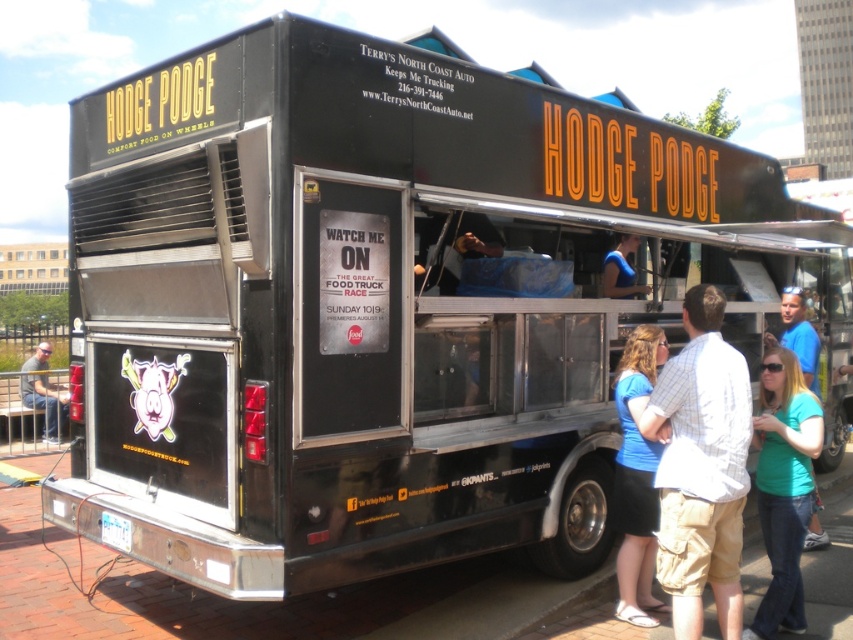
You are a customer standing in front of the Hodge Podge food truck and you see both the green matte shirt at lower right and the blue cotton shirt at center. You want to know if you can reach both shirts without moving your arms more than 30 inches apart. Can you do this?

The green matte shirt at lower right is 28.42 inches from the blue cotton shirt at center, so yes, you can reach both shirts without moving your arms more than 30 inches apart since the distance between them is less than 30 inches.

You are a customer standing in front of the black food truck. You notice two shirts displayed at the center of the truck. Which shirt is taller between the light blue shirt at center and the teal shirt at center?

The light blue shirt at center has a greater height compared to the teal shirt at center, so the light blue shirt at center is taller.